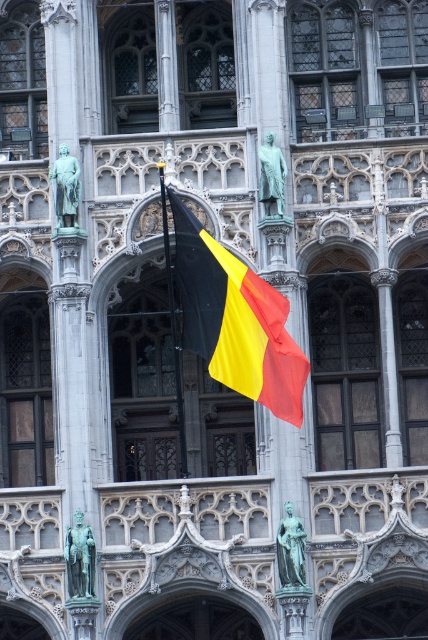
Consider the image. Is green patinated bronze statue at center shorter than green patinated bronze statue at upper left?

No, green patinated bronze statue at center is not shorter than green patinated bronze statue at upper left.

Which is behind, point (83, 586) or point (62, 186)?

The point (62, 186) is behind.

The height and width of the screenshot is (640, 428). What are the coordinates of `green patinated bronze statue at center` in the screenshot? It's located at (80, 560).

Who is positioned more to the right, green patinated bronze statue at center or bronze statue at upper center?

bronze statue at upper center is more to the right.

You are a GUI agent. You are given a task and a screenshot of the screen. Output one action in this format:
    pyautogui.click(x=<x>, y=<y>)
    Task: Click on the green patinated bronze statue at center
    
    Given the screenshot: What is the action you would take?
    pyautogui.click(x=80, y=560)

The image size is (428, 640). What are the coordinates of `green patinated bronze statue at center` in the screenshot? It's located at (80, 560).

Is black matte flag at center shorter than bronze statue at center?

Correct, black matte flag at center is not as tall as bronze statue at center.

Which is behind, point (216, 353) or point (285, 522)?

Positioned behind is point (285, 522).

Which is in front, point (219, 310) or point (291, 573)?

Positioned in front is point (291, 573).

The width and height of the screenshot is (428, 640). I want to click on black matte flag at center, so click(x=235, y=321).